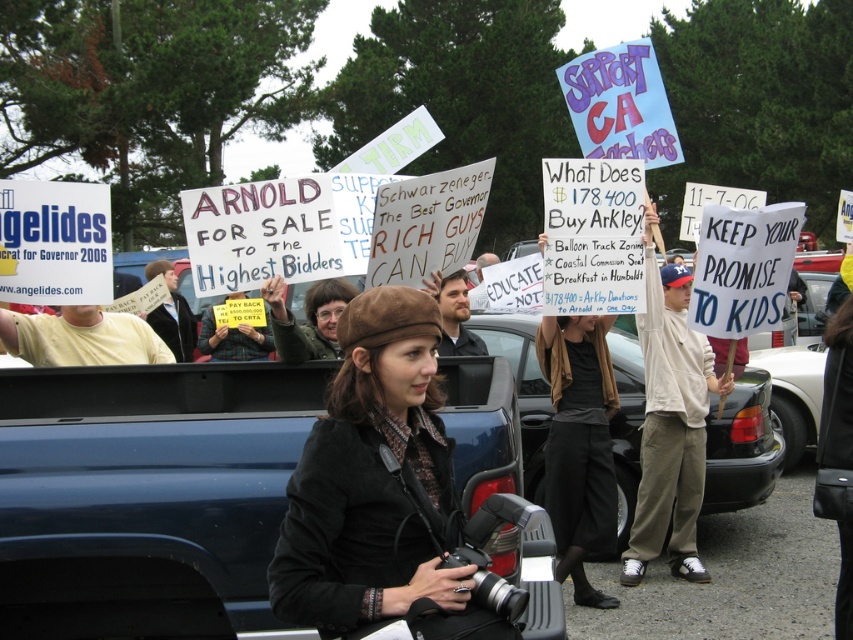
Does brown suede beret at center lie in front of black cotton pants at center?

Yes, brown suede beret at center is in front of black cotton pants at center.

Is brown suede beret at center wider than black cotton pants at center?

Yes, brown suede beret at center is wider than black cotton pants at center.

This screenshot has width=853, height=640. What do you see at coordinates (378, 486) in the screenshot? I see `brown suede beret at center` at bounding box center [378, 486].

Where is `brown suede beret at center`? brown suede beret at center is located at coordinates (378, 486).

Is brown suede beret at center smaller than black glossy car at center?

Yes, brown suede beret at center is smaller than black glossy car at center.

This screenshot has height=640, width=853. Find the location of `brown suede beret at center`. brown suede beret at center is located at coordinates (378, 486).

Where is `brown suede beret at center`? brown suede beret at center is located at coordinates (378, 486).

Does white fabric hoodie at center have a greater height compared to black glossy car at center?

Yes, white fabric hoodie at center is taller than black glossy car at center.

Who is positioned more to the right, white fabric hoodie at center or black glossy car at center?

Positioned to the right is black glossy car at center.

The width and height of the screenshot is (853, 640). Identify the location of white fabric hoodie at center. (670, 420).